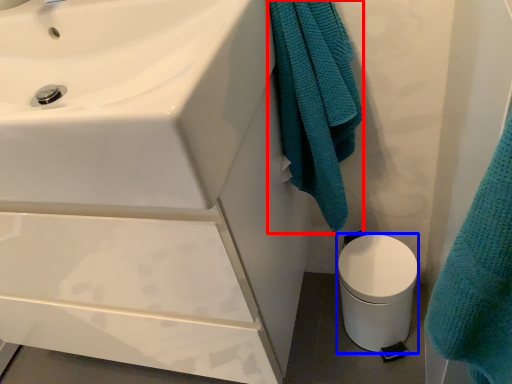
Question: Which point is further to the camera, bath towel (highlighted by a red box) or toilet bowl (highlighted by a blue box)?

Choices:
 (A) bath towel
 (B) toilet bowl

Answer: (B)